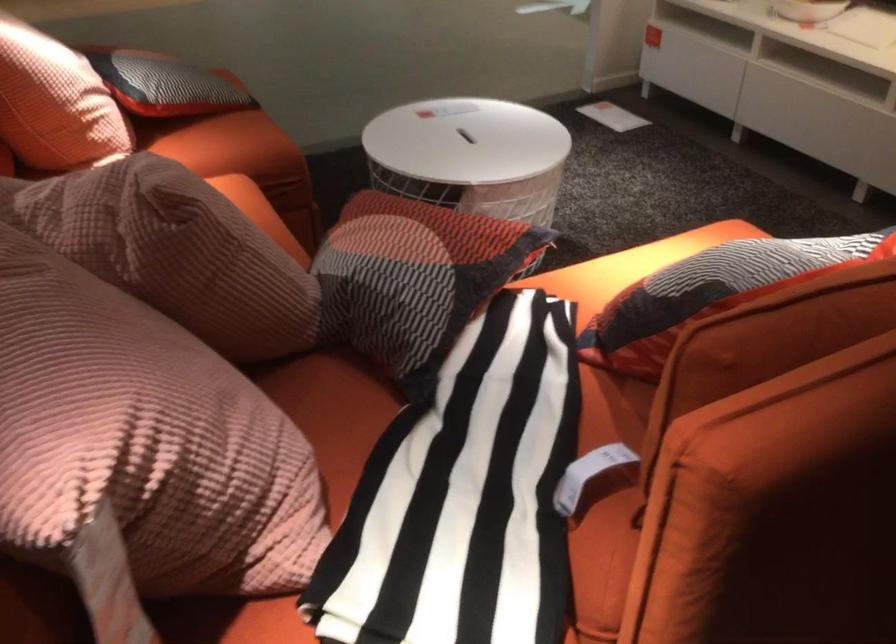
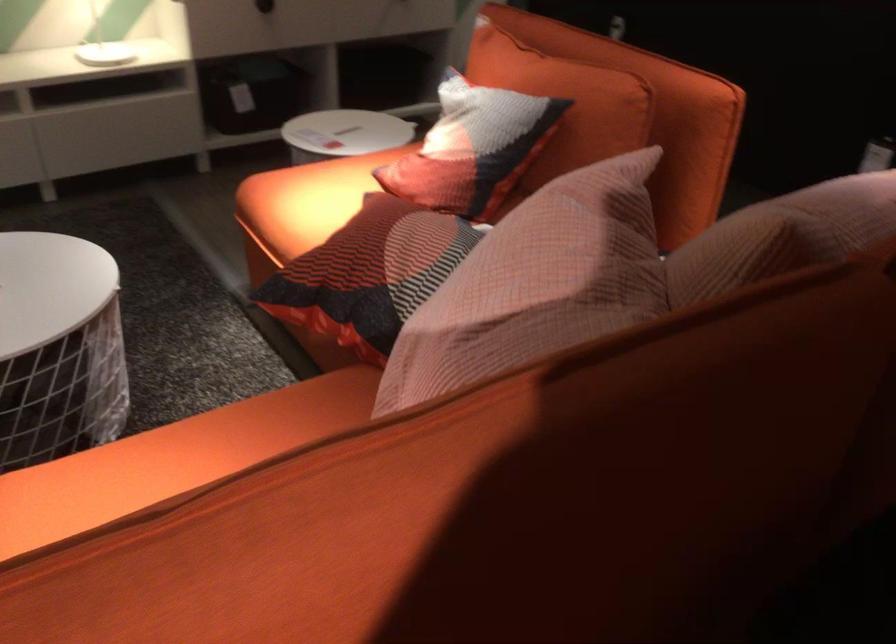
Where in the second image is the point corresponding to point (703, 278) from the first image?

(564, 102)